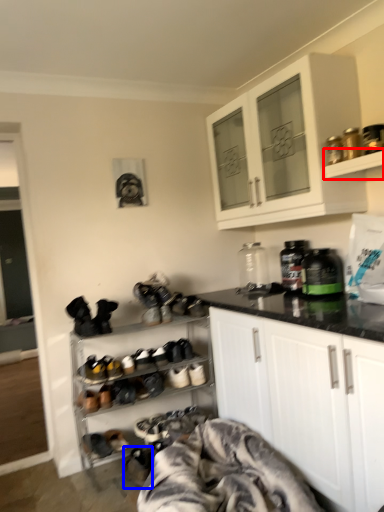
Question: Which object appears closest to the camera in this image, shelf (highlighted by a red box) or footwear (highlighted by a blue box)?

Choices:
 (A) shelf
 (B) footwear

Answer: (A)